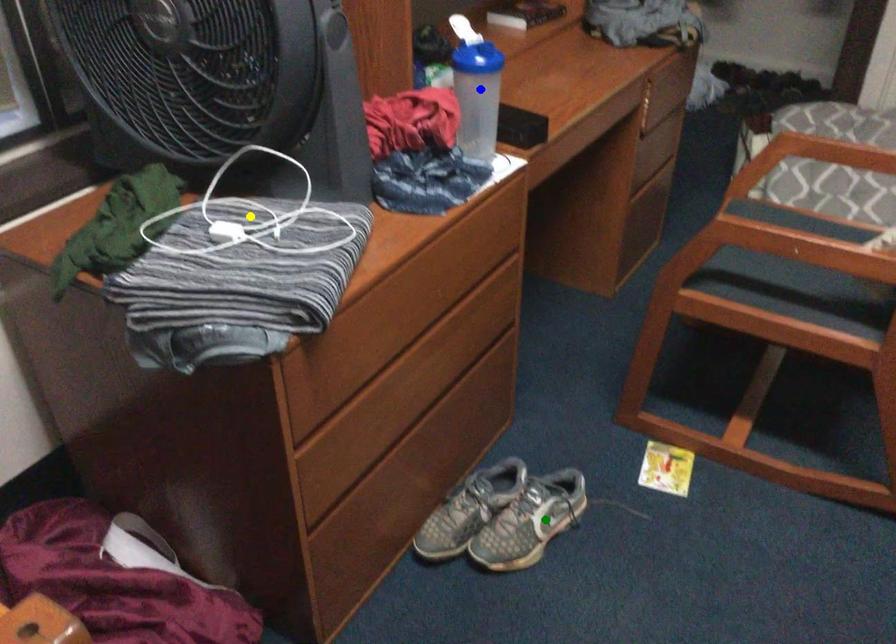
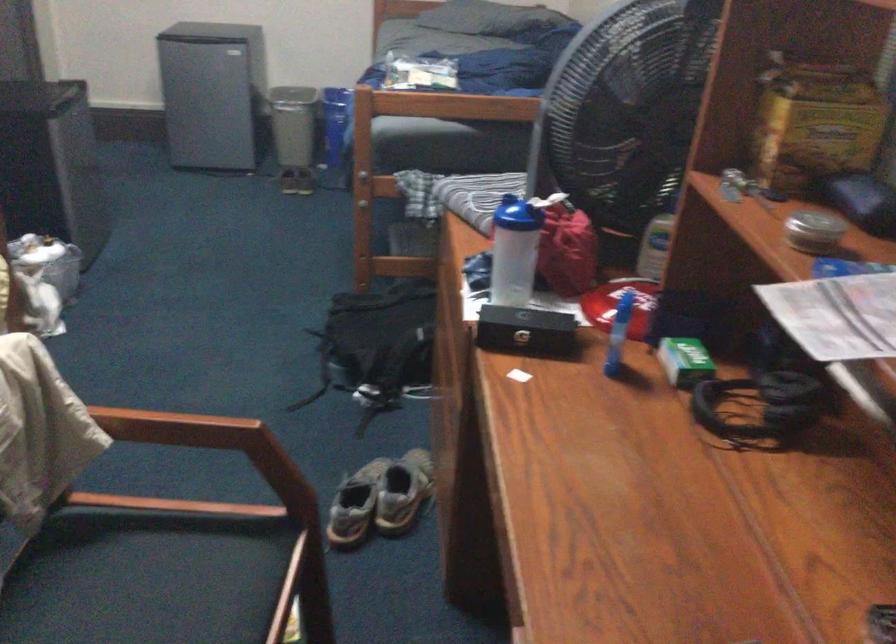
I am providing you with two images of the same scene from different viewpoints. Three points are marked in image1. Which point corresponds to a part or object that is occluded in image2?In image1, three points are marked. Which of them correspond to a part or object that is occluded in image2?Among the three points shown in image1, which one corresponds to a part or object that is no longer visible due to occlusion in image2?

yellow point cannot be seen in image2.